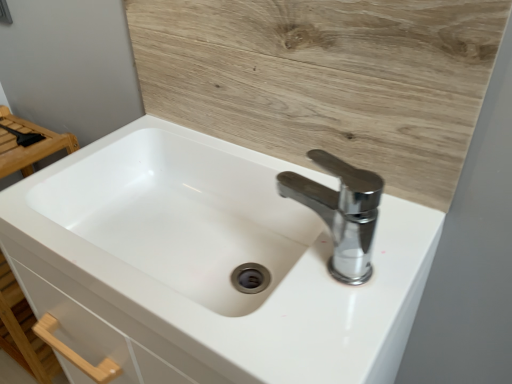
Question: From the image's perspective, does wooden at upper center appear lower than white glossy sink at center?

Choices:
 (A) no
 (B) yes

Answer: (A)

Question: Can you confirm if wooden at upper center is taller than white glossy sink at center?

Choices:
 (A) yes
 (B) no

Answer: (B)

Question: Can you confirm if wooden at upper center is positioned to the right of white glossy sink at center?

Choices:
 (A) no
 (B) yes

Answer: (B)

Question: Does wooden at upper center have a larger size compared to white glossy sink at center?

Choices:
 (A) no
 (B) yes

Answer: (A)

Question: Does wooden at upper center have a smaller size compared to white glossy sink at center?

Choices:
 (A) no
 (B) yes

Answer: (B)

Question: From a real-world perspective, is wooden at upper center physically located above or below chrome metallic faucet at upper right?

Choices:
 (A) below
 (B) above

Answer: (B)

Question: In the image, is wooden at upper center positioned in front of or behind chrome metallic faucet at upper right?

Choices:
 (A) behind
 (B) front

Answer: (A)

Question: Which is correct: wooden at upper center is inside chrome metallic faucet at upper right, or outside of it?

Choices:
 (A) inside
 (B) outside

Answer: (B)

Question: Is wooden at upper center wider or thinner than chrome metallic faucet at upper right?

Choices:
 (A) thin
 (B) wide

Answer: (A)

Question: Is chrome metallic faucet at upper right taller or shorter than white glossy sink at center?

Choices:
 (A) tall
 (B) short

Answer: (B)

Question: Considering their positions, is chrome metallic faucet at upper right located in front of or behind white glossy sink at center?

Choices:
 (A) behind
 (B) front

Answer: (A)

Question: Visually, is chrome metallic faucet at upper right positioned to the left or to the right of white glossy sink at center?

Choices:
 (A) left
 (B) right

Answer: (B)

Question: Is point [287, 193] positioned closer to the camera than point [117, 142]?

Choices:
 (A) farther
 (B) closer

Answer: (B)

Question: Considering the relative positions of white glossy sink at center and wooden at upper center in the image provided, is white glossy sink at center to the left or to the right of wooden at upper center?

Choices:
 (A) left
 (B) right

Answer: (A)

Question: Choose the correct answer: Is white glossy sink at center inside wooden at upper center or outside it?

Choices:
 (A) inside
 (B) outside

Answer: (B)